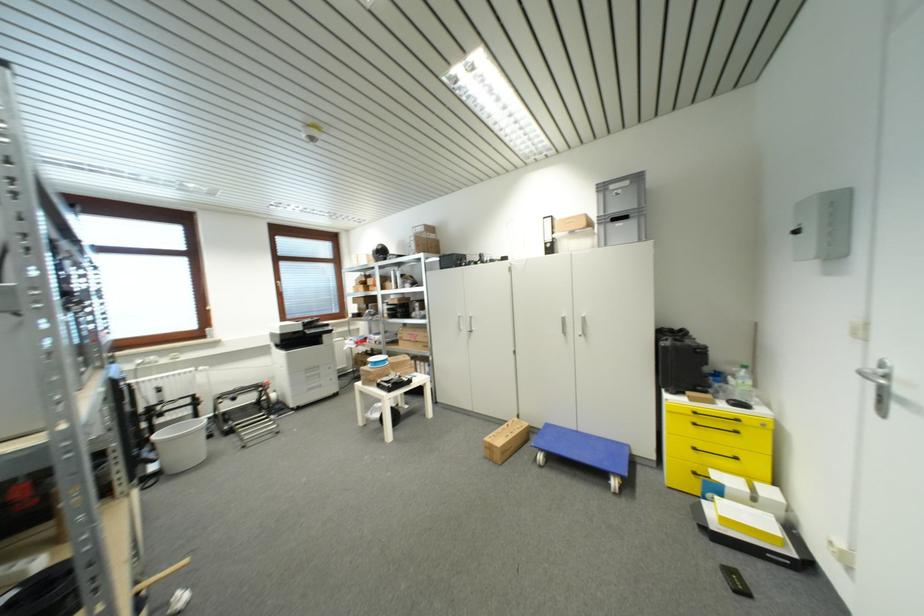
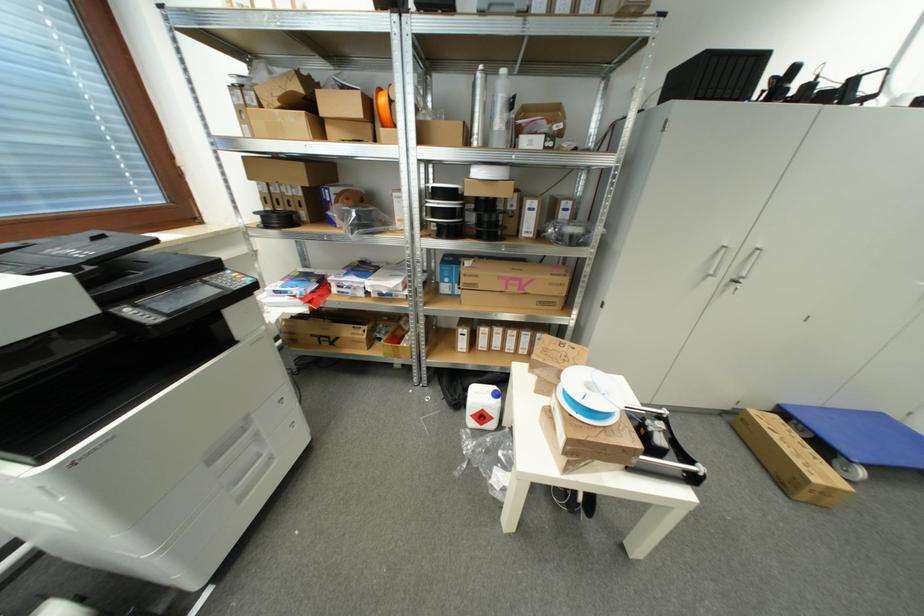
The point at (407, 315) is marked in the first image. Where is the corresponding point in the second image?

(493, 225)